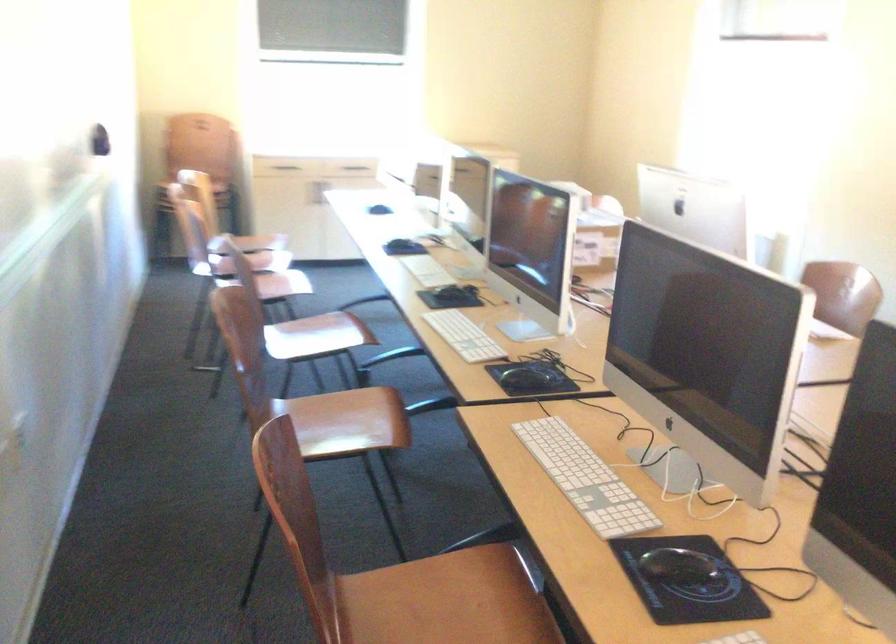
Question: The images are taken continuously from a first-person perspective. In which direction is your viewpoint rotating?

Choices:
 (A) Left
 (B) Right
 (C) Up
 (D) Down

Answer: (B)